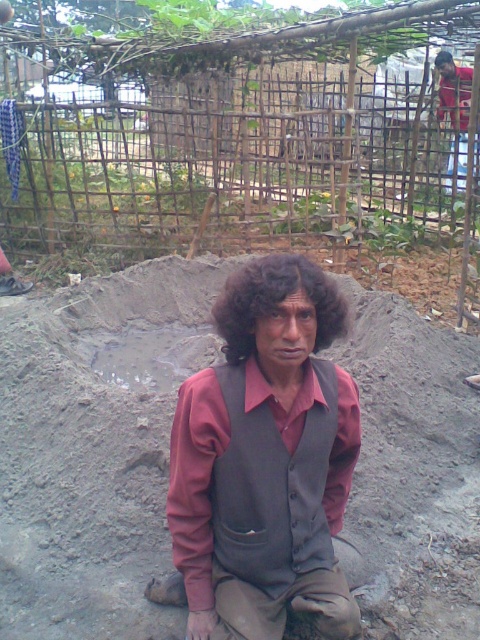
You are a photographer taking a portrait of the person in the scene. You want to ensure that the dark gray fabric vest at center and the dark curly hair at center are both clearly visible. Based on their positions, which one should you focus on first to ensure both are in focus?

The dark gray fabric vest at center is located below dark curly hair at center. To ensure both are in focus, you should focus on the dark curly hair at center first since it is higher up, allowing the vest to fall within the depth of field.

You are a photographer trying to capture the person in the scene. You want to focus on the dark gray fabric vest at center and the dark curly hair at center. Which object should you adjust your camera to the left to capture better?

The dark gray fabric vest at center is positioned on the left side of dark curly hair at center, so to capture the dark gray fabric vest at center better, you should adjust your camera to the left.

You are a photographer trying to capture the person in the scene. Which object, the dark gray fabric vest at center or the dark curly hair at center, would appear larger in your photo?

The dark gray fabric vest at center would appear larger in the photo because it is closer to the viewer than the dark curly hair at center.